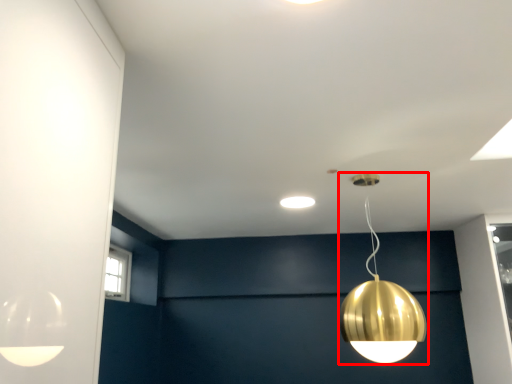
Question: From the image, what is the correct spatial relationship of lamp (annotated by the red box) in relation to lamp?

Choices:
 (A) left
 (B) right

Answer: (B)